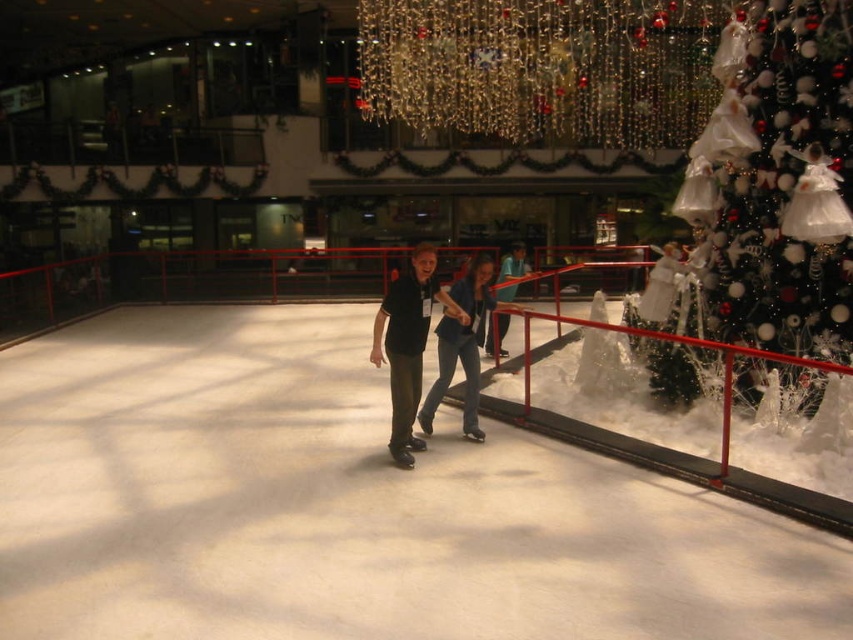
From the picture: You are planning to take a photo of the shiny green tree at right and the denim jacket at center from the left side of the ice rink. Which object will appear closer to the camera in the photo?

The shiny green tree at right will appear closer to the camera in the photo because it is positioned over the denim jacket at center, meaning it is in front of it from the left side perspective.

You are planning to place a small Christmas tree decoration on the white smooth ice at center. According to the coordinates provided, where exactly should you place it?

The white smooth ice at center should have the decoration placed at coordinates point (347,506).